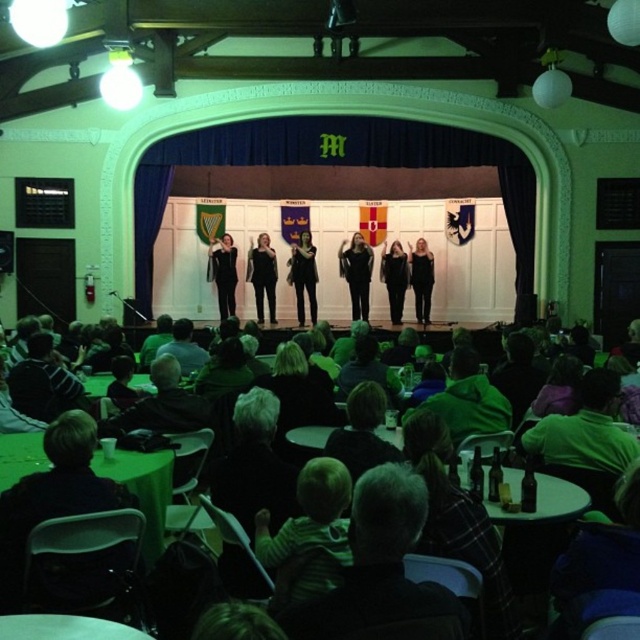
You are a photographer setting up for a group photo in the auditorium. You need to position two performers so that their clothing details are visible. The dark gray shirt at lower center and the green fuzzy jacket at center are both in your frame. Which performer should you move closer to the camera to ensure their clothing detail is captured better?

The dark gray shirt at lower center is thinner than the green fuzzy jacket at center. To ensure clothing details are visible, move the performer in the dark gray shirt at lower center closer to the camera since thinner fabrics may require closer focus for detail capture.

You are a photographer standing at the back of the auditorium. You want to take a photo of the two points on the stage labeled as point (282, 614) and point (508, 413). Which point should you focus on first to ensure both are in frame without moving the camera?

You should focus on point (282, 614) first because it is in front of point (508, 413), so keeping it centered will allow the second point to remain in the frame behind it.

You are a photographer in the audience of this performance and want to take a closeup shot of the green fuzzy jacket at center. What coordinates should you aim your camera at?

You should aim your camera at coordinates point (468, 400) to capture the green fuzzy jacket at center.